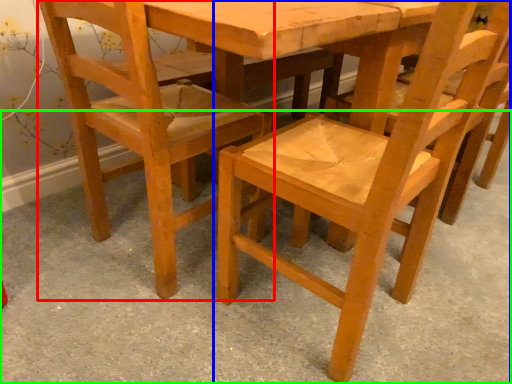
Question: Which is farther away from chair (highlighted by a red box)? chair (highlighted by a blue box) or concrete (highlighted by a green box)?

Choices:
 (A) chair
 (B) concrete

Answer: (B)